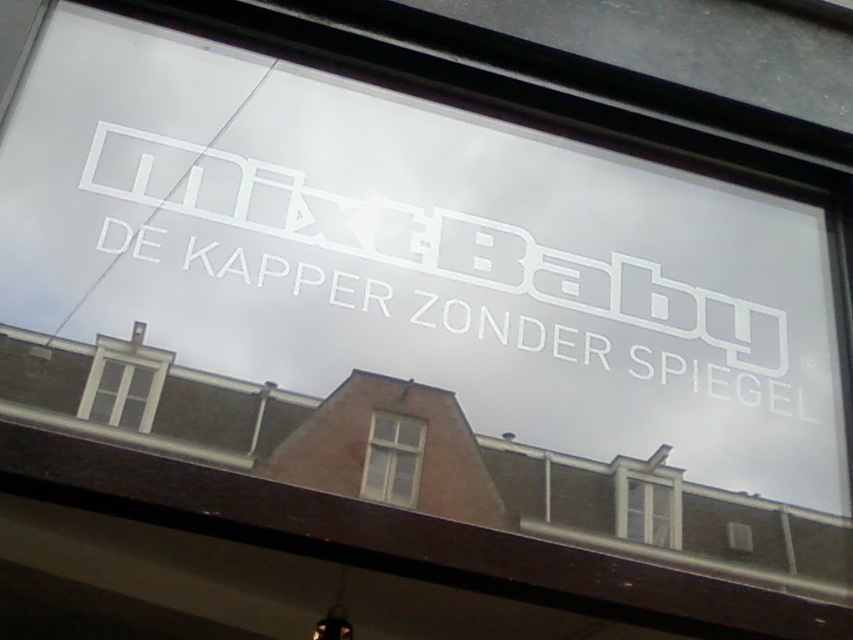
Question: Which of the following is the farthest from the observer?

Choices:
 (A) white matte sign at center
 (B) white glass window at lower left
 (C) white wooden window at center
 (D) clear glass window at center

Answer: (A)

Question: Which object appears farthest from the camera in this image?

Choices:
 (A) clear glass window at center
 (B) white wooden window at center

Answer: (A)

Question: Does white glass window at lower left have a greater width compared to white wooden window at center?

Choices:
 (A) yes
 (B) no

Answer: (A)

Question: Which point is farther to the camera?

Choices:
 (A) clear glass window at center
 (B) white glass window at lower left
 (C) white matte sign at center
 (D) white wooden window at center

Answer: (C)

Question: Can you confirm if white wooden window at center is thinner than clear glass window at center?

Choices:
 (A) no
 (B) yes

Answer: (B)

Question: Is white matte sign at center below white wooden window at center?

Choices:
 (A) no
 (B) yes

Answer: (A)